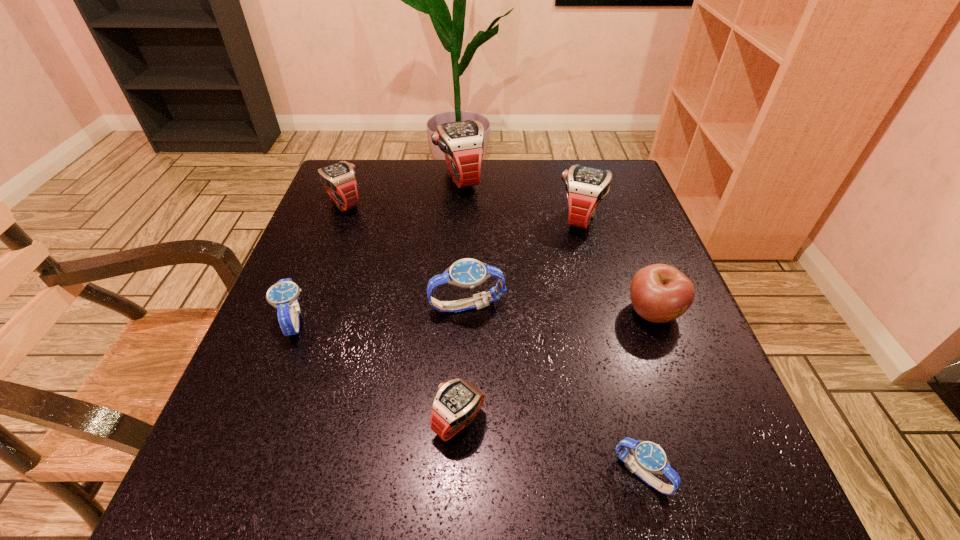
This screenshot has height=540, width=960. What are the coordinates of `free region at the near left corner of the desktop` in the screenshot? It's located at point(248,495).

Find the location of a particular element. free space at the far right corner of the desktop is located at coordinates (611, 183).

What are the coordinates of `empty space between the leftmost blue watch and the rightmost red watch` in the screenshot? It's located at (437, 269).

I want to click on free space between the leftmost blue watch and the smallest red watch, so click(x=376, y=371).

Find the location of a particular element. empty location between the nearest red watch and the second blue watch from left to right is located at coordinates (463, 364).

Where is `vacant area that lies between the second nearest object and the second tallest object`? vacant area that lies between the second nearest object and the second tallest object is located at coordinates (519, 320).

Locate an element on the screen. free space between the second biggest red watch and the biggest red watch is located at coordinates (519, 198).

This screenshot has height=540, width=960. I want to click on free space between the biggest blue watch and the apple, so click(561, 309).

Find the location of a particular element. empty location between the leftmost blue watch and the biggest red watch is located at coordinates (377, 249).

Identify which object is the second closest to the apple. Please provide its 2D coordinates. Your answer should be formatted as a tuple, i.e. [(x, y)], where the tuple contains the x and y coordinates of a point satisfying the conditions above.

[(649, 457)]